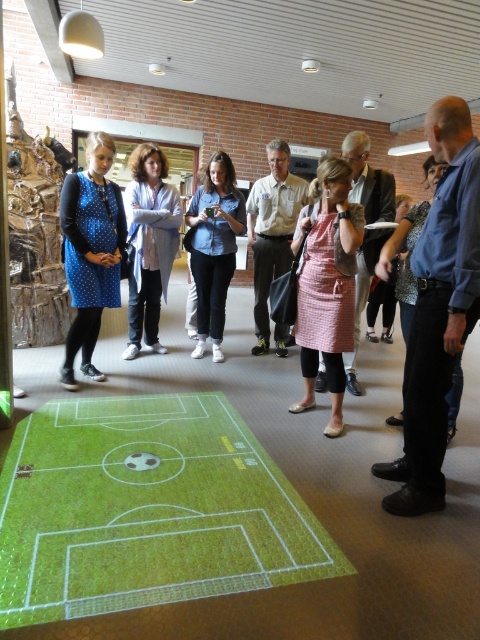
Who is more distant from viewer, (48, 460) or (94, 209)?

The point (94, 209) is more distant.

Consider the image. Does green textured carpet at center have a greater height compared to blue dotted dress at left?

No.

Is point (245, 456) farther from camera compared to point (90, 310)?

No, it is in front of (90, 310).

Identify the location of green textured carpet at center. (145, 509).

Can you confirm if green textured carpet at center is positioned below black leather pants at right?

Correct, green textured carpet at center is located below black leather pants at right.

Does green textured carpet at center have a lesser width compared to black leather pants at right?

Incorrect, green textured carpet at center's width is not less than black leather pants at right's.

In order to click on green textured carpet at center in this screenshot , I will do `click(145, 509)`.

In the scene shown: Can you confirm if blue dotted dress at left is positioned to the right of black leather pants at right?

No, blue dotted dress at left is not to the right of black leather pants at right.

Between blue dotted dress at left and black leather pants at right, which one is positioned higher?

blue dotted dress at left

Is point (96, 220) less distant than point (394, 420)?

No, it is not.

At what (x,y) coordinates should I click in order to perform the action: click on blue dotted dress at left. Please return your answer as a coordinate pair (x, y). Looking at the image, I should click on (91, 252).